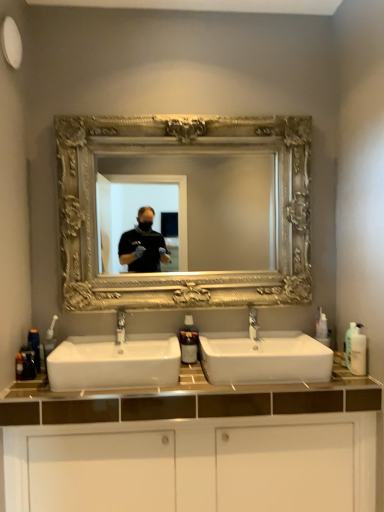
Locate an element on the screen. Image resolution: width=384 pixels, height=512 pixels. unoccupied region to the right of silver metallic tap at center, which is the 2th tap from left to right is located at coordinates (281, 346).